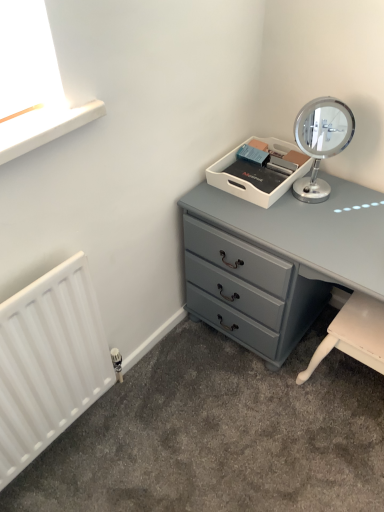
You are a GUI agent. You are given a task and a screenshot of the screen. Output one action in this format:
    pyautogui.click(x=<x>, y=<y>)
    Task: Click on the free space between matte gray chest of drawers at center and white matte radiator at lower left
    The width and height of the screenshot is (384, 512).
    Given the screenshot: What is the action you would take?
    pyautogui.click(x=195, y=424)